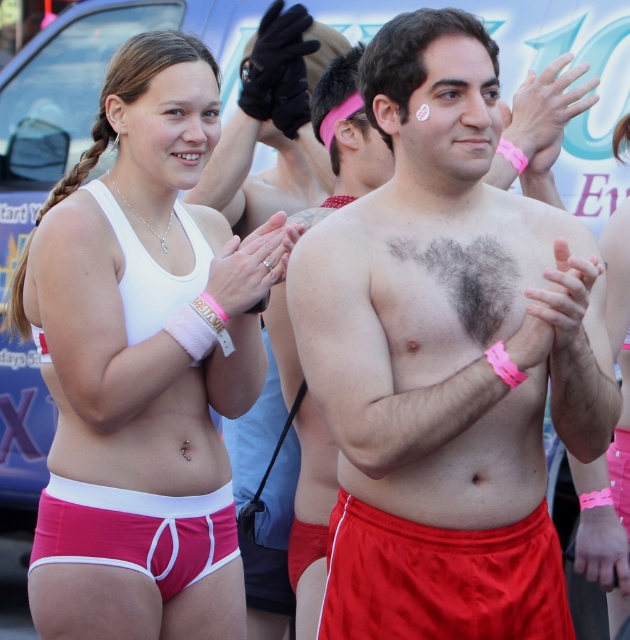
Question: From the image, what is the correct spatial relationship of smooth skin chest at center in relation to dark brown hairy chest at center?

Choices:
 (A) right
 (B) left

Answer: (B)

Question: Does smooth skin chest at center come behind pink fabric shorts at center?

Choices:
 (A) no
 (B) yes

Answer: (A)

Question: Which object is positioned farthest from the smooth skin chest at center?

Choices:
 (A) dark brown hairy chest at center
 (B) matte red shorts at lower center
 (C) pink fabric shorts at center
 (D) pink fabric underwear at lower left

Answer: (D)

Question: Which point is closer to the camera taking this photo?

Choices:
 (A) (168, 570)
 (B) (127, 152)
 (C) (364, 220)

Answer: (C)

Question: Does smooth skin chest at center have a smaller size compared to pink fabric underwear at lower left?

Choices:
 (A) yes
 (B) no

Answer: (B)

Question: Which point is farther to the camera?

Choices:
 (A) (505, 556)
 (B) (483, 332)

Answer: (B)